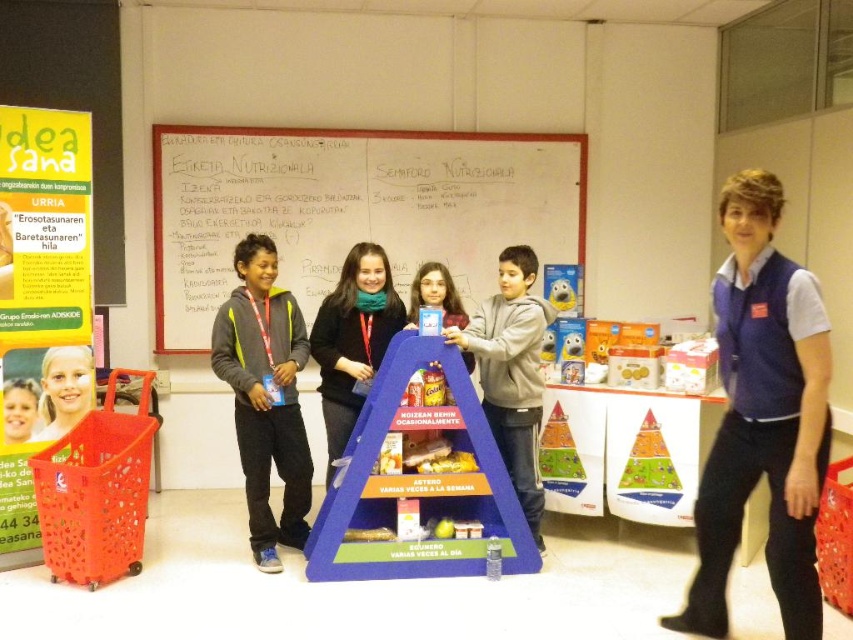
You are a nutritionist at an educational event. You notice a blue cardboard pyramid at center and a person with blonde hair at center. Which object is closer to the front of the scene?

The blue cardboard pyramid at center is closer to the front of the scene than the blonde hair at center, as it is positioned in front of it.

You are a nutritionist at a community event and see the blue fabric vest at center and the blue cardboard pyramid at center. Which object is located to the right of the other?

The blue fabric vest at center is positioned on the right side of blue cardboard pyramid at center.